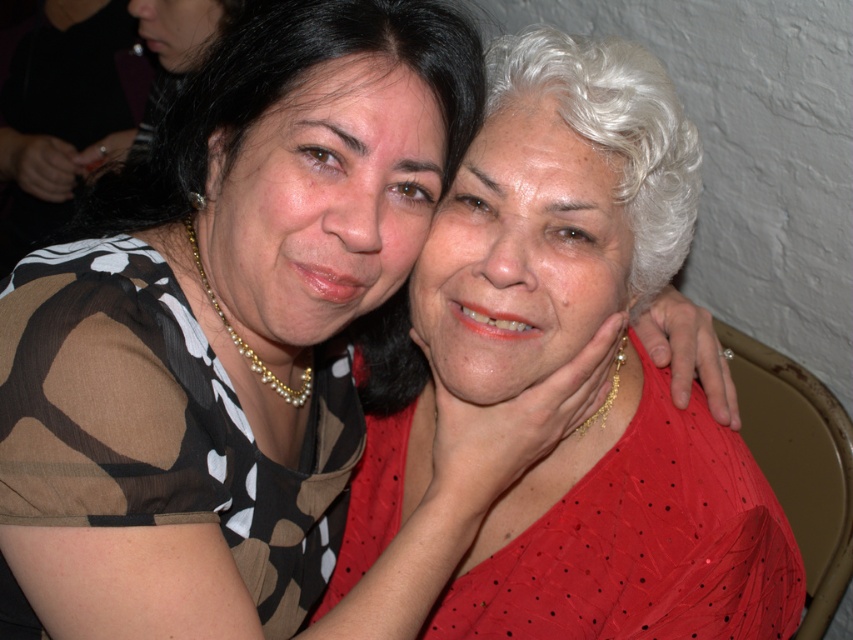
Question: Which point is farther to the camera?

Choices:
 (A) brown printed fabric dress at upper left
 (B) red sheer dress at center

Answer: (B)

Question: Considering the relative positions of brown printed fabric dress at upper left and red sheer dress at center in the image provided, where is brown printed fabric dress at upper left located with respect to red sheer dress at center?

Choices:
 (A) left
 (B) right

Answer: (A)

Question: Considering the relative positions of brown printed fabric dress at upper left and red sheer dress at center in the image provided, where is brown printed fabric dress at upper left located with respect to red sheer dress at center?

Choices:
 (A) below
 (B) above

Answer: (B)

Question: Which of the following is the closest to the observer?

Choices:
 (A) (570, 611)
 (B) (3, 422)

Answer: (B)

Question: Is brown printed fabric dress at upper left above red sheer dress at center?

Choices:
 (A) yes
 (B) no

Answer: (A)